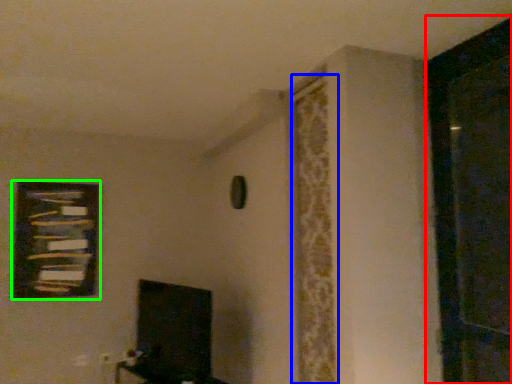
Question: Which object is positioned closest to screen door (highlighted by a red box)? Select from curtain (highlighted by a blue box) and picture frame (highlighted by a green box).

Choices:
 (A) curtain
 (B) picture frame

Answer: (A)